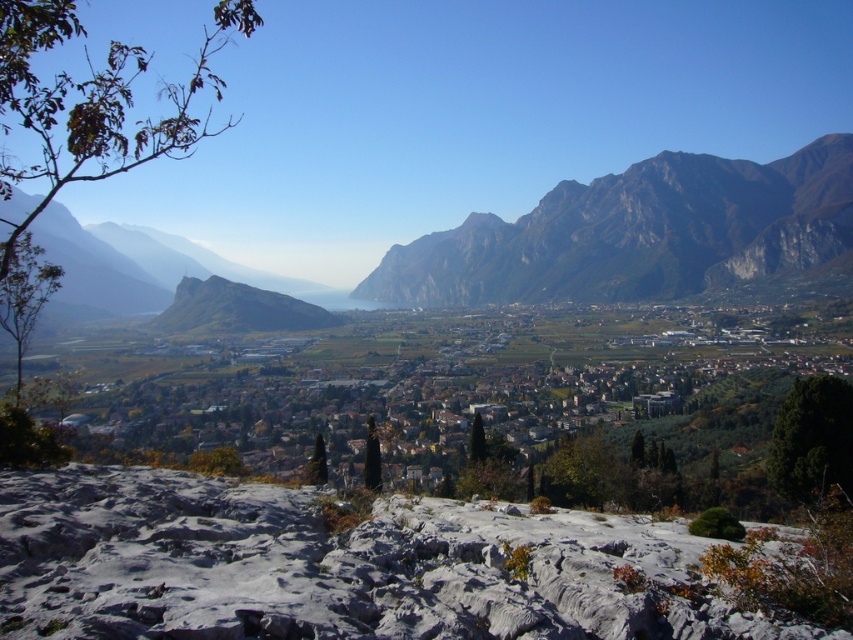
Question: Which is farther from the rugged stone mountain at center?

Choices:
 (A) gray rough rock at lower center
 (B) rugged stone mountain at upper right

Answer: (A)

Question: Which point is closer to the camera taking this photo?

Choices:
 (A) (654, 604)
 (B) (640, 230)
 (C) (113, 305)

Answer: (A)

Question: Is gray rough rock at lower center positioned before rugged stone mountain at center?

Choices:
 (A) no
 (B) yes

Answer: (B)

Question: Where is rugged stone mountain at upper right located in relation to rugged stone mountain at center in the image?

Choices:
 (A) below
 (B) above

Answer: (B)

Question: Which is farther from the gray rough rock at lower center?

Choices:
 (A) rugged stone mountain at upper right
 (B) rugged stone mountain at center

Answer: (B)

Question: Is gray rough rock at lower center thinner than rugged stone mountain at center?

Choices:
 (A) no
 (B) yes

Answer: (B)